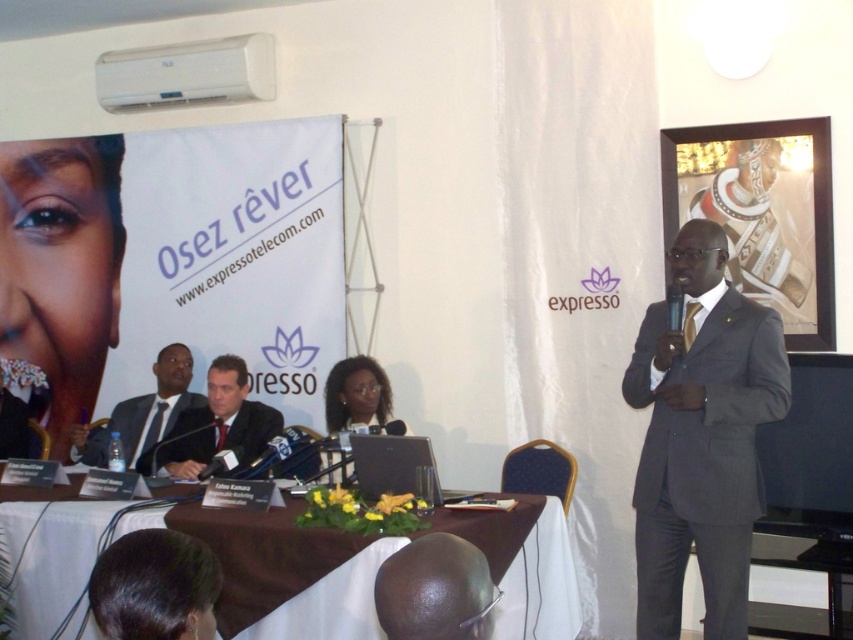
You are organizing a photo shoot for a corporate event and need to ensure that two key speakers, wearing the dark suit at center and the dark gray suit at lower left, are positioned close enough for a group photo. The camera you are using has a maximum focus range of 16 inches. Can these two speakers stand in their current positions to be captured clearly in the same photo?

The distance between the dark suit at center and the dark gray suit at lower left is 15.76 inches, which is within the camera maximum focus range of 16 inches. Therefore, they can stand in their current positions and be captured clearly in the same photo.

You are a photographer at the event and need to capture a photo that includes both the gray pinstripe suit at right and the matte black face at left. Based on their positions, which side of the frame should you focus on to include both?

Since the gray pinstripe suit at right is positioned on the right side of matte black face at left, you should focus the frame centrally between both to include both the gray pinstripe suit at right and the matte black face at left.

From the picture: You are attending a conference and need to introduce the speaker who is speaking now. Which one is the speaker between the gray pinstripe suit at right and the matte black face at left?

The gray pinstripe suit at right is the speaker because they are in front of the matte black face at left, indicating they are the one actively speaking.